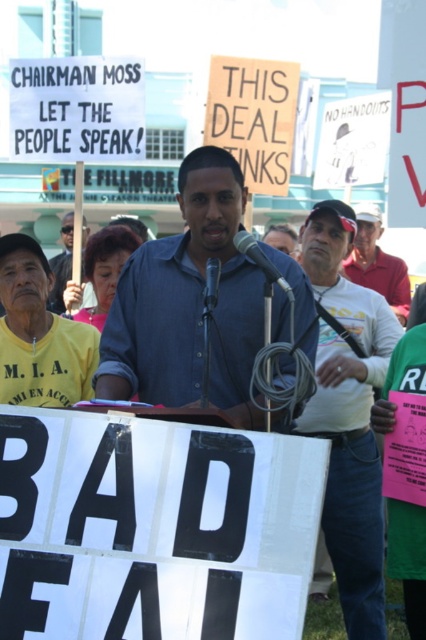
You are a photographer at the event and want to capture both the white cotton shirt at center and the red shirt at center in a single frame. Which shirt should you focus on to ensure both are in the frame without cropping?

The white cotton shirt at center has a smaller width than the red shirt at center, so focusing on the white cotton shirt at center would allow both to fit within the frame since it takes up less space.

You are standing at the origin point of the image coordinate system. The speaker with a blue button up shirt is at the center. Where is the white cotton shirt at center located in relation to the speaker?

The white cotton shirt at center is located at point 0.650 on the x axis and 0.819 on the y axis relative to the speaker at the center.

You are a photographer at the event and need to capture both the blue denim shirt at center and the red shirt at center in a single shot. Which person should you position closer to the camera to ensure both are fully visible?

The blue denim shirt at center is much taller than the red shirt at center, so positioning the red shirt at center closer to the camera will help balance their sizes in the photo.